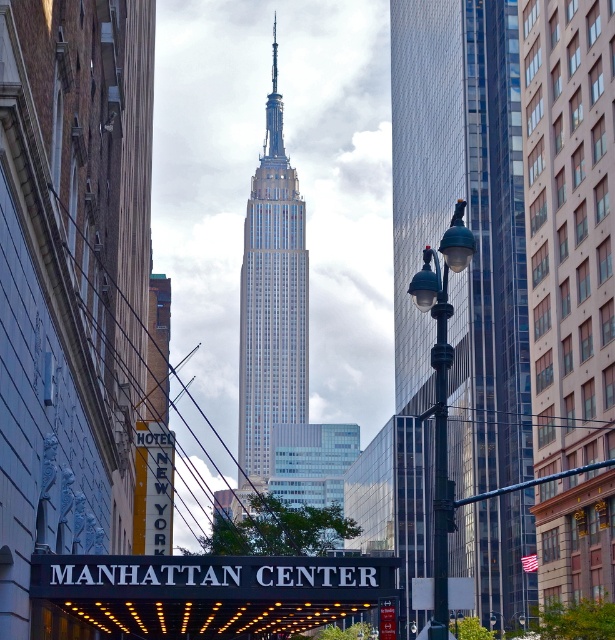
You are standing on the street in front of the Empire State Building and notice a specific point at coordinates [466,225]. What structure is located at that point?

The glassy steel skyscraper at center is located at point [466,225].

You are a tourist standing on the sidewalk and see the glassy steel skyscraper at center and the green glass streetlight at center. Which object is located to the right of the other?

The glassy steel skyscraper at center is positioned on the right side of green glass streetlight at center, so the skyscraper is to the right of the streetlight.

You are standing on the street in front of the Empire State Building and notice a point marked at coordinates (466, 225). Based on the scene description, what does this point indicate?

The point at (466, 225) marks the glassy steel skyscraper at center, which is the Empire State Building.